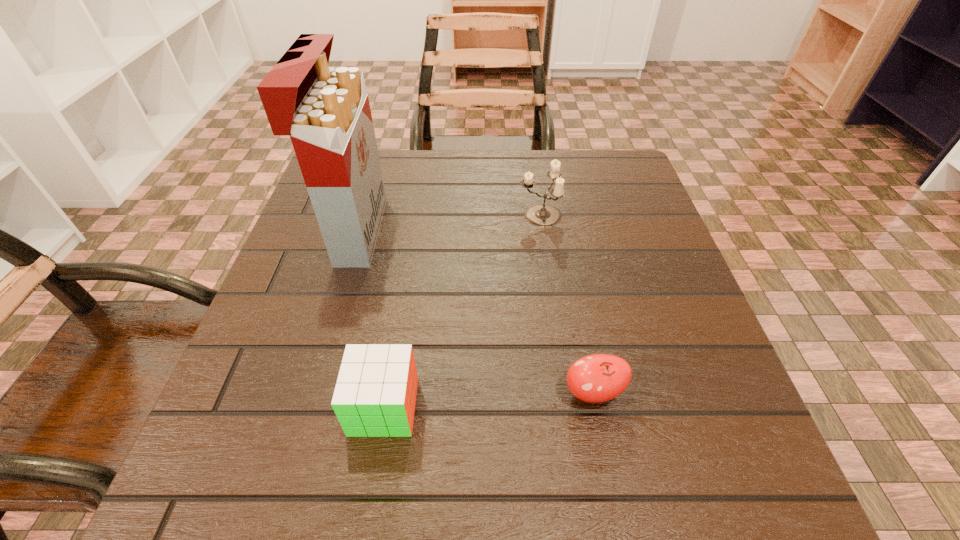
Find the location of `object identified as the third closest to the third object from right to left`. object identified as the third closest to the third object from right to left is located at coordinates (541, 215).

Select which object appears as the closest to the third object from right to left. Please provide its 2D coordinates. Your answer should be formatted as a tuple, i.e. [(x, y)], where the tuple contains the x and y coordinates of a point satisfying the conditions above.

[(595, 378)]

Find the location of `vacant space that satisfies the following two spatial constraints: 1. with the lid open on the cigarette case; 2. on the back side of the apple`. vacant space that satisfies the following two spatial constraints: 1. with the lid open on the cigarette case; 2. on the back side of the apple is located at coordinates (307, 393).

The height and width of the screenshot is (540, 960). What are the coordinates of `vacant region that satisfies the following two spatial constraints: 1. on the front side of the third shortest object; 2. with the lid open on the leftmost object` in the screenshot? It's located at (542, 231).

What are the coordinates of `vacant region that satisfies the following two spatial constraints: 1. with the lid open on the tallest object; 2. on the right side of the cube` in the screenshot? It's located at (303, 407).

Where is `blank space that satisfies the following two spatial constraints: 1. with the lid open on the second object from left to right; 2. on the left side of the leftmost object`? blank space that satisfies the following two spatial constraints: 1. with the lid open on the second object from left to right; 2. on the left side of the leftmost object is located at coordinates (303, 407).

At what (x,y) coordinates should I click in order to perform the action: click on vacant space that satisfies the following two spatial constraints: 1. with the lid open on the tallest object; 2. on the right side of the cube. Please return your answer as a coordinate pair (x, y). Looking at the image, I should click on (303, 407).

Locate an element on the screen. This screenshot has height=540, width=960. blank area in the image that satisfies the following two spatial constraints: 1. on the back side of the apple; 2. on the right side of the cube is located at coordinates (386, 393).

Find the location of `blank space that satisfies the following two spatial constraints: 1. with the lid open on the tallest object; 2. on the right side of the apple`. blank space that satisfies the following two spatial constraints: 1. with the lid open on the tallest object; 2. on the right side of the apple is located at coordinates click(x=307, y=393).

The image size is (960, 540). What are the coordinates of `blank space that satisfies the following two spatial constraints: 1. with the lid open on the cigarette case; 2. on the right side of the third object from right to left` in the screenshot? It's located at (303, 407).